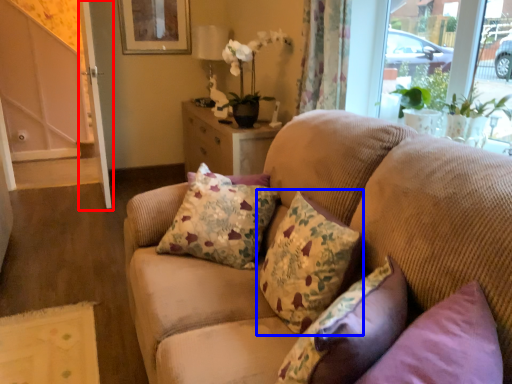
Question: Which object is further to the camera taking this photo, screen door (highlighted by a red box) or pillow (highlighted by a blue box)?

Choices:
 (A) screen door
 (B) pillow

Answer: (A)